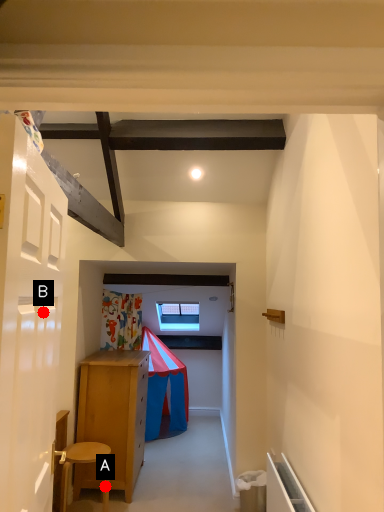
Question: Two points are circled on the image, labeled by A and B beside each circle. Which point is closer to the camera?

Choices:
 (A) A is closer
 (B) B is closer

Answer: (B)